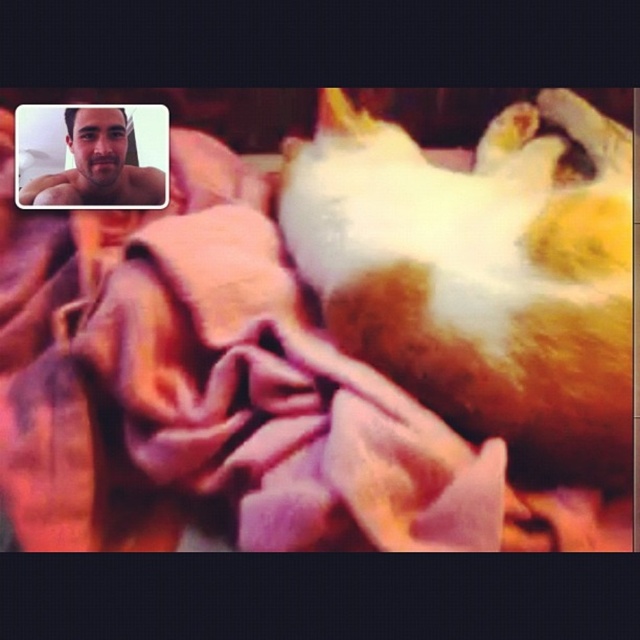
You are a photographer reviewing a photo. You notice a point at coordinates (481, 273) in the image. What object is located at that point?

The fluffy orange cat at center is located at point (481, 273).

You are a photographer reviewing this image. You notice the fluffy orange cat at center and the matte skin at upper left. Which object is positioned closer to the camera?

The fluffy orange cat at center is closer to the viewer than the matte skin at upper left.